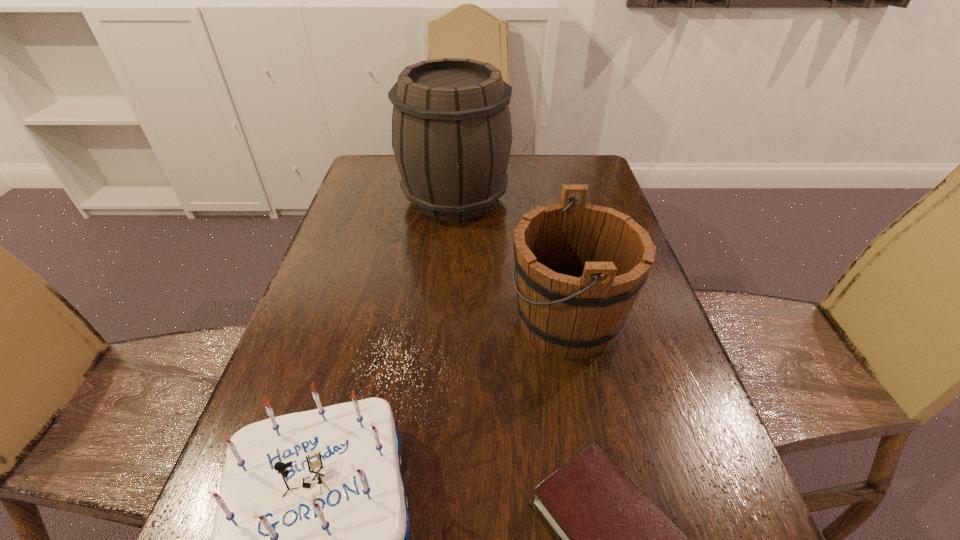
Find the location of a particular element. This screenshot has width=960, height=540. the taller wine bucket is located at coordinates (451, 125).

Identify the location of the farthest object. pyautogui.click(x=451, y=125).

Identify the location of the second tallest object. The image size is (960, 540). (580, 267).

At what (x,y) coordinates should I click in order to perform the action: click on the second farthest object. Please return your answer as a coordinate pair (x, y). Looking at the image, I should click on (580, 267).

Locate an element on the screen. Image resolution: width=960 pixels, height=540 pixels. vacant space situated 0.230m on the front of the tallest object is located at coordinates (448, 288).

Locate an element on the screen. The image size is (960, 540). free location located on the side of the nearer wine bucket with the handle for carrying is located at coordinates (380, 320).

This screenshot has width=960, height=540. I want to click on vacant region located 0.270m on the side of the nearer wine bucket with the handle for carrying, so click(385, 320).

What are the coordinates of `vacant space located on the side of the nearer wine bucket with the handle for carrying` in the screenshot? It's located at (413, 320).

At what (x,y) coordinates should I click in order to perform the action: click on object located at the far edge. Please return your answer as a coordinate pair (x, y). The height and width of the screenshot is (540, 960). Looking at the image, I should click on (451, 125).

Identify the location of object at the left edge. This screenshot has height=540, width=960. (451, 125).